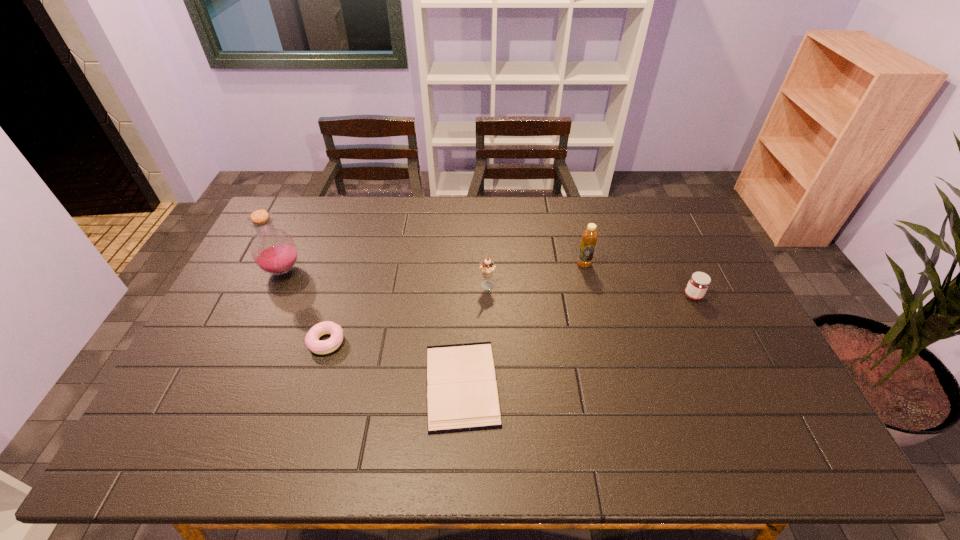
This screenshot has width=960, height=540. In order to click on vacant space at the near edge of the desktop in this screenshot , I will do `click(231, 449)`.

Image resolution: width=960 pixels, height=540 pixels. I want to click on vacant space at the right edge of the desktop, so click(689, 247).

At what (x,y) coordinates should I click in order to perform the action: click on vacant space at the far right corner of the desktop. Please return your answer as a coordinate pair (x, y). This screenshot has width=960, height=540. Looking at the image, I should click on (677, 212).

Locate an element on the screen. The image size is (960, 540). free spot between the fourth shortest object and the jam is located at coordinates (590, 292).

The image size is (960, 540). I want to click on vacant area that lies between the shortest object and the fourth shortest object, so click(x=474, y=336).

I want to click on vacant area between the fifth object from right to left and the fourth tallest object, so pyautogui.click(x=510, y=319).

Locate an element on the screen. free point between the shortest object and the jam is located at coordinates click(x=577, y=340).

Find the location of a particular element. empty space that is in between the doughnut and the shorter bottle is located at coordinates [x=455, y=303].

This screenshot has height=540, width=960. I want to click on vacant space that's between the right bottle and the leftmost object, so click(x=433, y=267).

Where is `empty location between the fifth object from left to right and the fourth shortest object`? The width and height of the screenshot is (960, 540). empty location between the fifth object from left to right and the fourth shortest object is located at coordinates (536, 275).